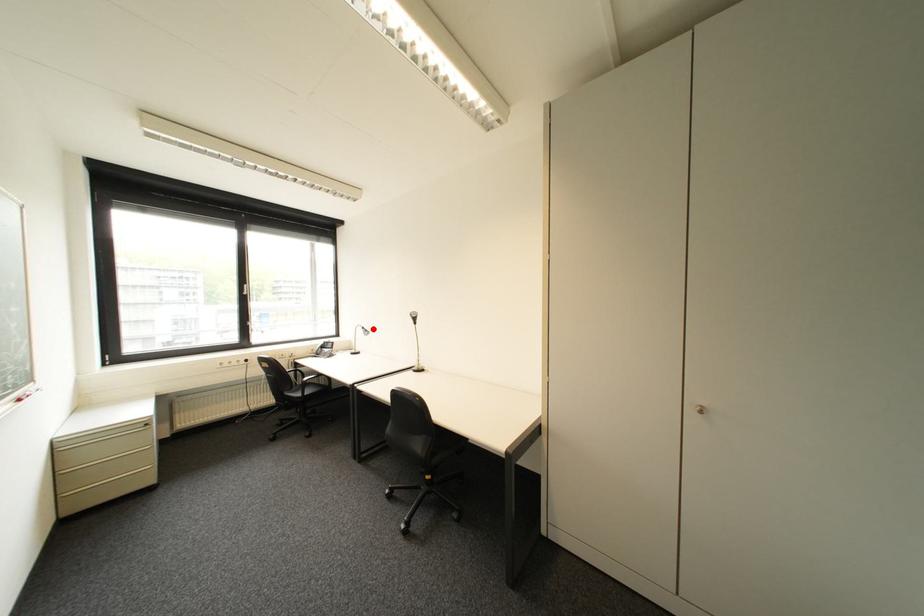
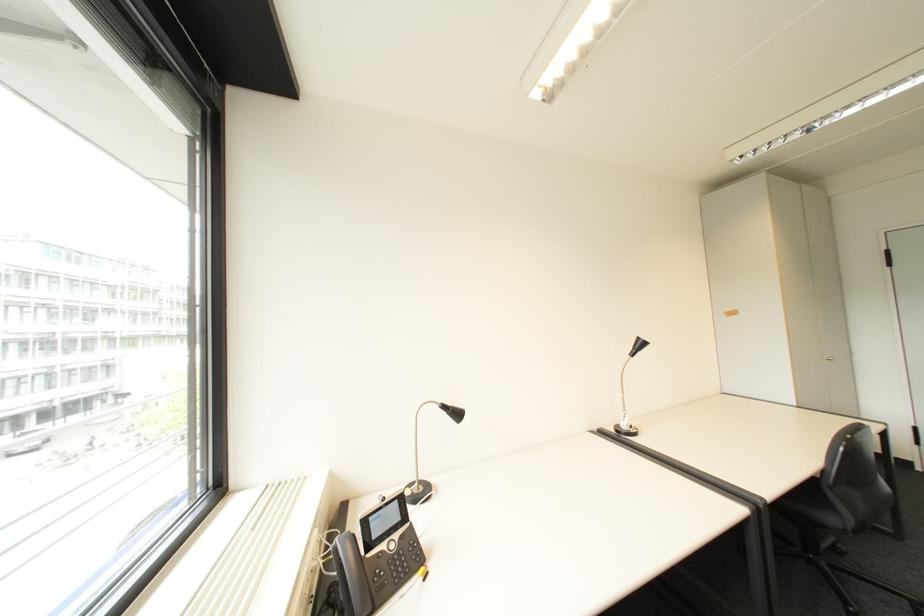
The point at the highlighted location is marked in the first image. Where is the corresponding point in the second image?

(455, 407)